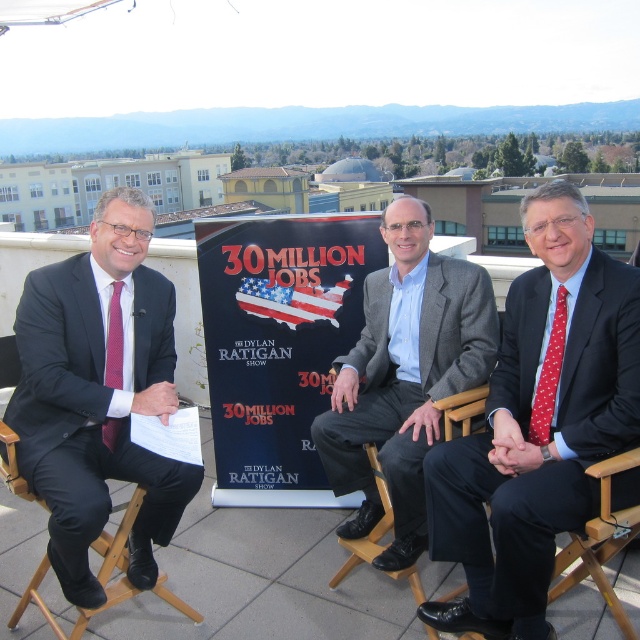
You are a photographer standing in front of the blue fabric poster at center and the maroon dotted tie at left. Which object is closer to you?

The blue fabric poster at center is closer to you because it is further to the viewer than the maroon dotted tie at left.

You are a photographer standing at the front of the scene. You need to take a photo of the polished dark suit at center and the blue fabric poster at center. Which object will appear larger in the photo?

The polished dark suit at center will appear larger in the photo because it is closer to the viewer than the blue fabric poster at center.

You are a camera operator who needs to film the blue fabric poster at center during a segment. The camera you are using has a minimum focus distance of 10 feet. Can you film the poster without moving the camera or the poster?

The blue fabric poster at center and camera are 12.53 feet apart from each other. Since the minimum focus distance is 10 feet, the camera can film the poster without needing to move either the camera or the poster because the distance is within the focus range.